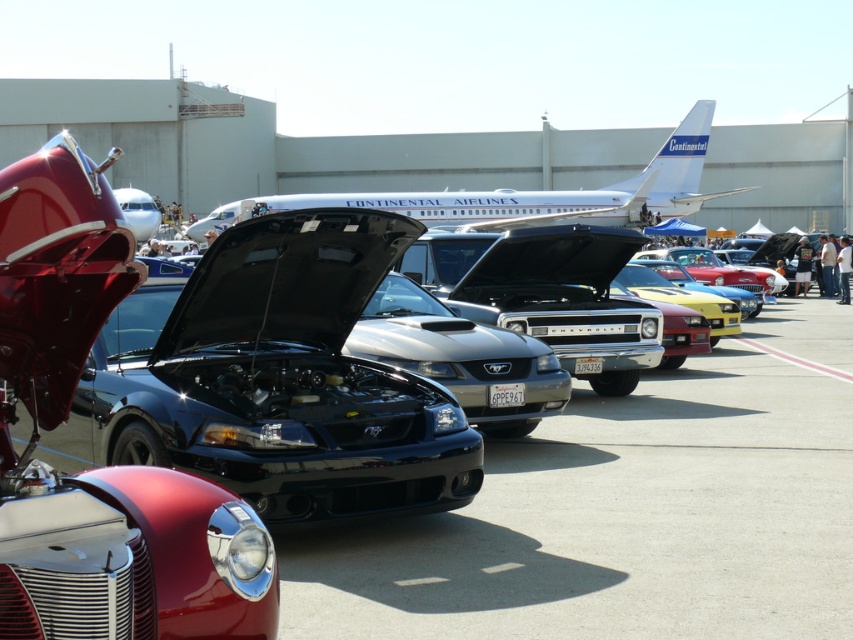
Question: Is shiny chrome car at left bigger than white glossy airplane at upper center?

Choices:
 (A) no
 (B) yes

Answer: (A)

Question: Is shiny chrome car at left below white glossy airplane at upper center?

Choices:
 (A) yes
 (B) no

Answer: (A)

Question: Which point appears farthest from the camera in this image?

Choices:
 (A) (48, 232)
 (B) (672, 180)

Answer: (B)

Question: Can you confirm if shiny chrome car at left is thinner than white glossy airplane at upper center?

Choices:
 (A) no
 (B) yes

Answer: (B)